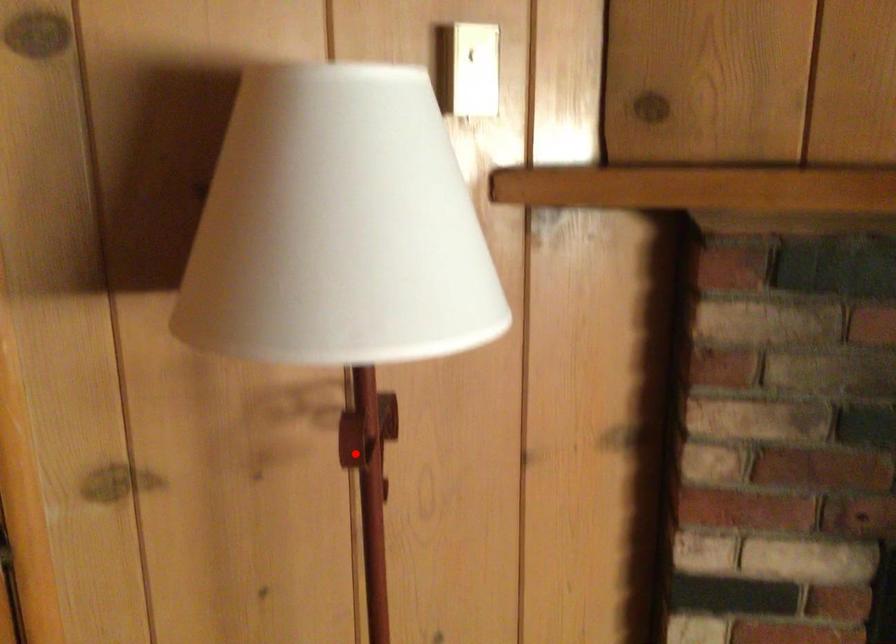
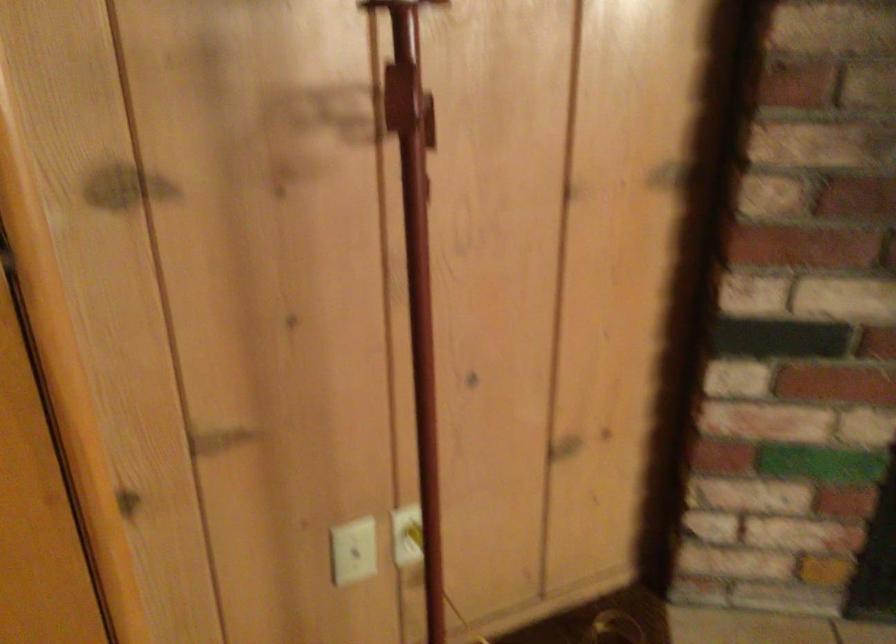
Where in the second image is the point corresponding to the highlighted location from the first image?

(399, 98)